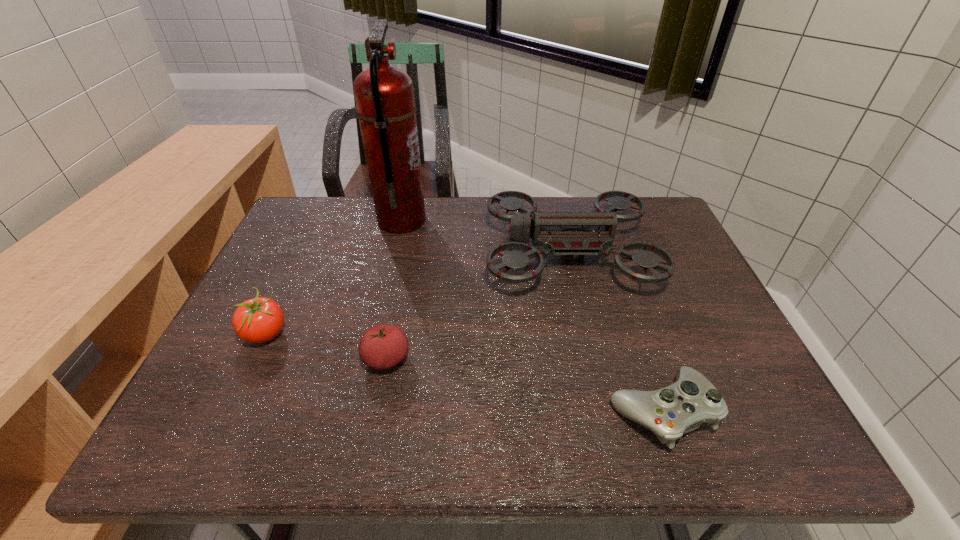
Locate an element on the screen. The height and width of the screenshot is (540, 960). the tallest object is located at coordinates (384, 95).

Find the location of `the fourth shortest object`. the fourth shortest object is located at coordinates (562, 233).

Identify the location of the left tomato. (258, 320).

Locate an element on the screen. the right tomato is located at coordinates (382, 347).

The image size is (960, 540). Find the location of `control`. control is located at coordinates (681, 407).

Where is `vacant region located on the side of the tallest object with the handle and hose`? Image resolution: width=960 pixels, height=540 pixels. vacant region located on the side of the tallest object with the handle and hose is located at coordinates (549, 221).

Identify the location of vacant area situated 0.120m on the front-facing side of the fourth shortest object. (444, 254).

Locate an element on the screen. Image resolution: width=960 pixels, height=540 pixels. vacant area situated on the front-facing side of the fourth shortest object is located at coordinates (391, 254).

Locate an element on the screen. This screenshot has width=960, height=540. vacant position located on the front-facing side of the fourth shortest object is located at coordinates (436, 254).

Identify the location of blank area located 0.230m on the front of the left tomato. The height and width of the screenshot is (540, 960). (209, 451).